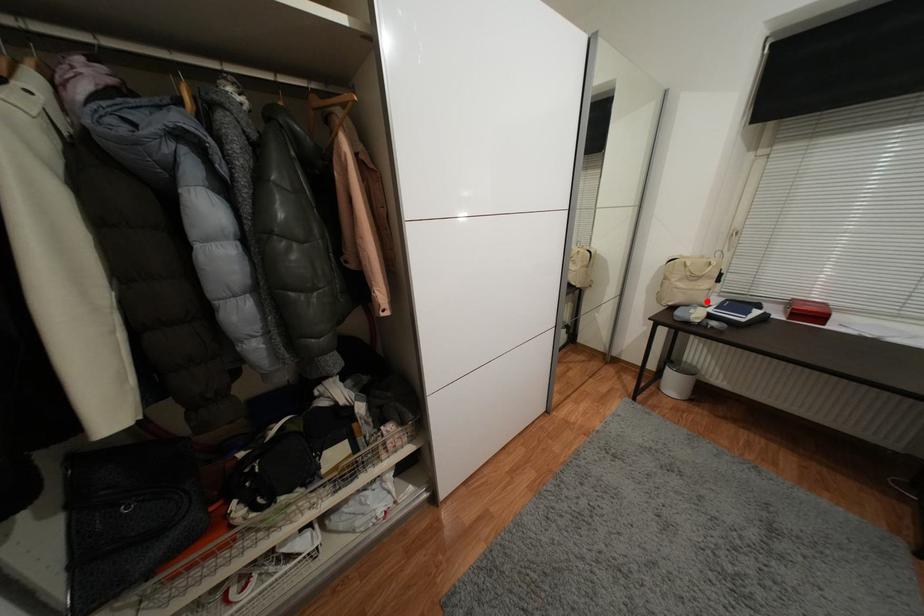
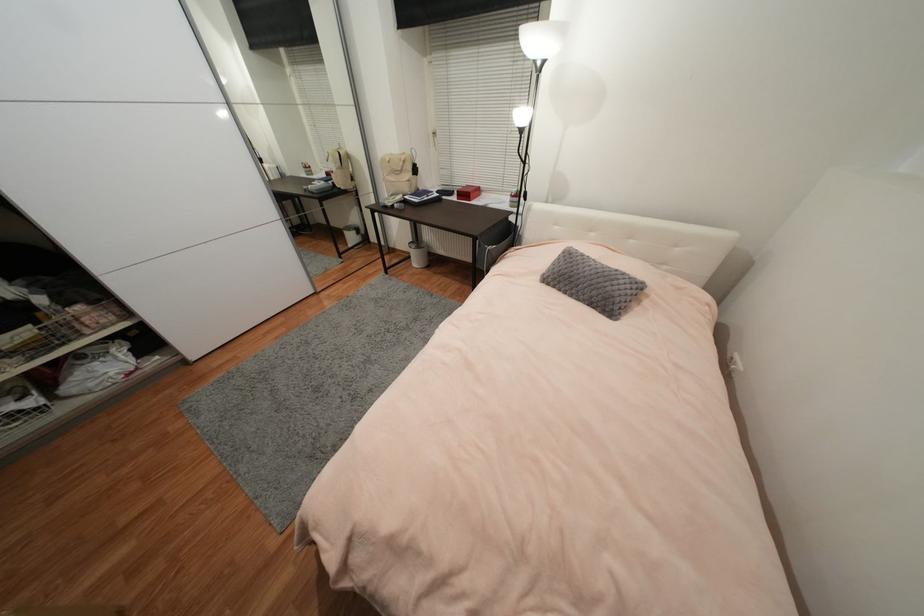
The point at the highlighted location is marked in the first image. Where is the corresponding point in the second image?

(410, 191)